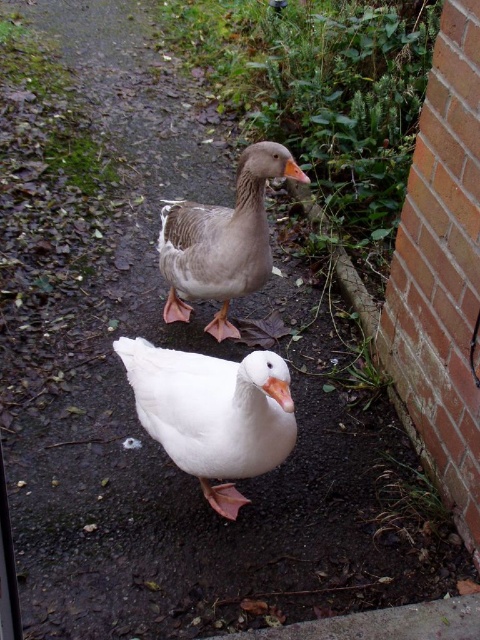
Does white matte duck at center appear on the left side of gray matte duck at center?

Indeed, white matte duck at center is positioned on the left side of gray matte duck at center.

Is white matte duck at center to the right of gray matte duck at center from the viewer's perspective?

Incorrect, white matte duck at center is not on the right side of gray matte duck at center.

Is point (273, 406) positioned in front of point (239, 211)?

Yes, point (273, 406) is in front of point (239, 211).

Where is `white matte duck at center`? The image size is (480, 640). white matte duck at center is located at coordinates (213, 412).